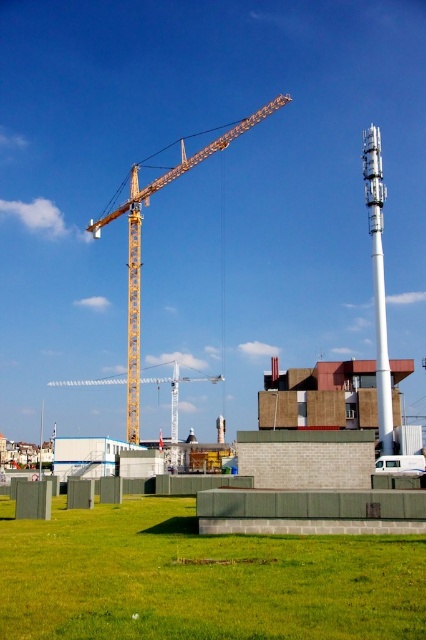
Question: Which point is farther from the camera taking this photo?

Choices:
 (A) (172, 412)
 (B) (379, 464)
 (C) (376, 179)

Answer: (A)

Question: Based on their relative distances, which object is farther from the white matte van at lower right?

Choices:
 (A) white metallic tower at right
 (B) yellow metallic crane at center
 (C) yellow metallic crane at upper center

Answer: (C)

Question: Does yellow metallic crane at center have a smaller size compared to white matte van at lower right?

Choices:
 (A) no
 (B) yes

Answer: (A)

Question: Considering the relative positions of yellow metallic crane at upper center and yellow metallic crane at center in the image provided, where is yellow metallic crane at upper center located with respect to yellow metallic crane at center?

Choices:
 (A) above
 (B) below

Answer: (A)

Question: Considering the real-world distances, which object is farthest from the white matte van at lower right?

Choices:
 (A) yellow metallic crane at upper center
 (B) yellow metallic crane at center
 (C) white metallic tower at right

Answer: (A)

Question: Does yellow metallic crane at upper center have a lesser width compared to white metallic tower at right?

Choices:
 (A) yes
 (B) no

Answer: (B)